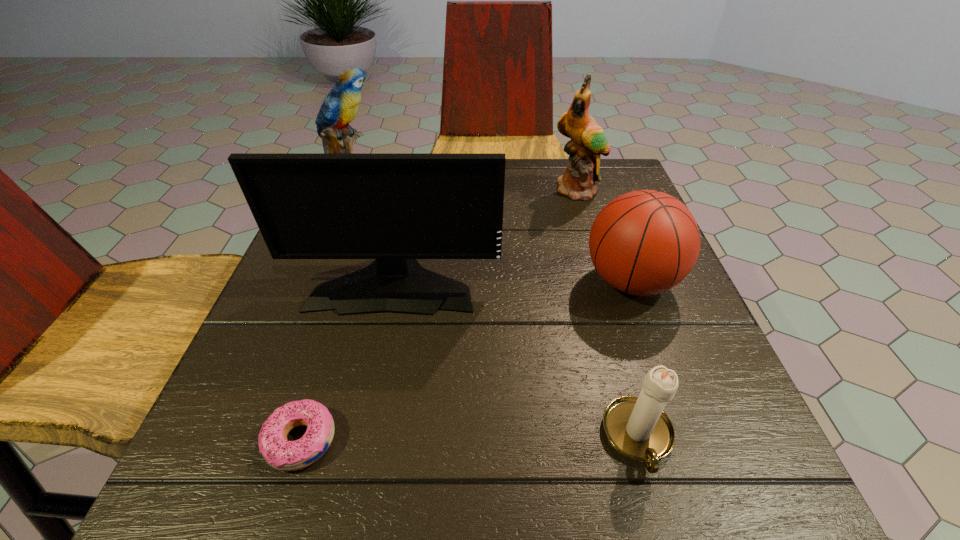
Where is `empty location between the right parrot and the shortest object`? The image size is (960, 540). empty location between the right parrot and the shortest object is located at coordinates (440, 315).

In order to click on vacant area that lies between the basketball and the candle holder in this screenshot , I will do `click(635, 360)`.

The height and width of the screenshot is (540, 960). I want to click on vacant space that's between the shortest object and the third shortest object, so click(466, 361).

This screenshot has height=540, width=960. I want to click on unoccupied area between the right parrot and the shortest object, so click(440, 315).

Image resolution: width=960 pixels, height=540 pixels. Find the location of `vacant space that's between the fifth tallest object and the shortest object`. vacant space that's between the fifth tallest object and the shortest object is located at coordinates (469, 439).

Identify the location of free space that is in between the left parrot and the fifth tallest object. (497, 316).

I want to click on vacant area that lies between the right parrot and the shortest object, so click(440, 315).

Where is `the third closest object to the left parrot`? Image resolution: width=960 pixels, height=540 pixels. the third closest object to the left parrot is located at coordinates (645, 242).

Image resolution: width=960 pixels, height=540 pixels. I want to click on object that ranks as the second closest to the doughnut, so click(x=637, y=427).

Locate an element on the screen. blank area in the image that satisfies the following two spatial constraints: 1. on the back side of the third shortest object; 2. on the face of the left parrot is located at coordinates pyautogui.click(x=599, y=194).